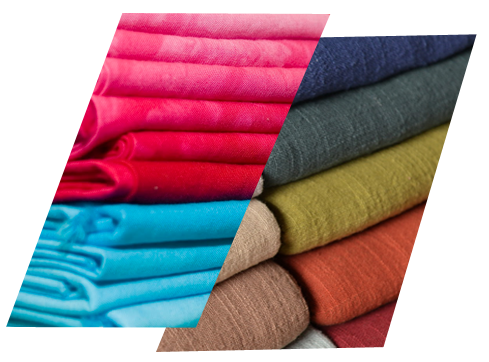
Locate an element on the screen. pink fabric is located at coordinates [160, 108], [159, 74], [172, 45], [190, 17].